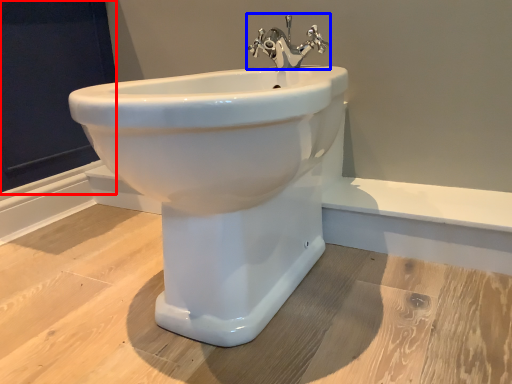
Question: Which object is further to the camera taking this photo, screen door (highlighted by a red box) or tap (highlighted by a blue box)?

Choices:
 (A) screen door
 (B) tap

Answer: (A)